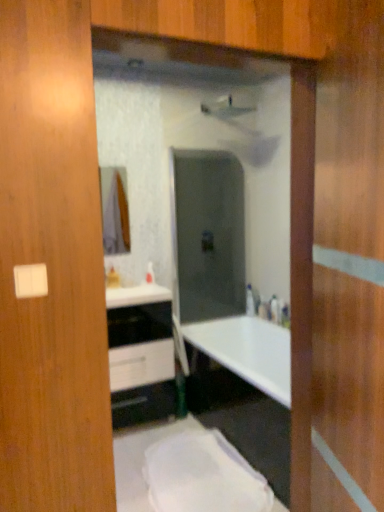
Question: Considering the positions of satin nickel faucet at center and white glossy cabinet at center in the image, is satin nickel faucet at center taller or shorter than white glossy cabinet at center?

Choices:
 (A) tall
 (B) short

Answer: (B)

Question: In the image, is satin nickel faucet at center positioned in front of or behind white glossy cabinet at center?

Choices:
 (A) front
 (B) behind

Answer: (B)

Question: From a real-world perspective, is satin nickel faucet at center above or below white glossy cabinet at center?

Choices:
 (A) above
 (B) below

Answer: (A)

Question: Is white glossy cabinet at center inside the boundaries of satin nickel faucet at center, or outside?

Choices:
 (A) outside
 (B) inside

Answer: (A)

Question: In the image, is white glossy cabinet at center positioned in front of or behind satin nickel faucet at center?

Choices:
 (A) behind
 (B) front

Answer: (B)

Question: From the image's perspective, is white glossy cabinet at center above or below satin nickel faucet at center?

Choices:
 (A) above
 (B) below

Answer: (B)

Question: Based on their positions, is white glossy cabinet at center located to the left or right of satin nickel faucet at center?

Choices:
 (A) right
 (B) left

Answer: (B)